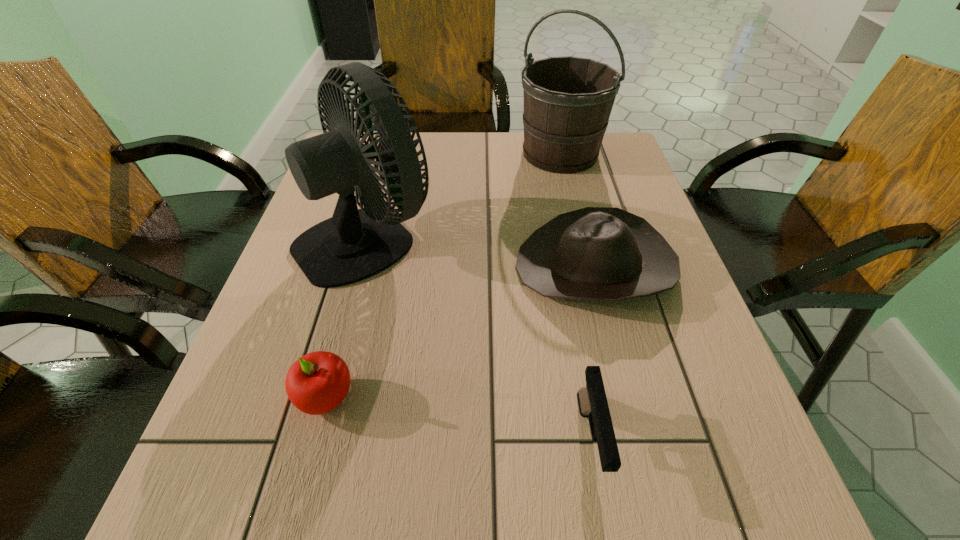
The height and width of the screenshot is (540, 960). In order to click on free space at the right edge of the desktop in this screenshot , I will do `click(648, 200)`.

Find the location of `free point at the near right corner`. free point at the near right corner is located at coordinates (659, 506).

Image resolution: width=960 pixels, height=540 pixels. Find the location of `unoccupied area between the apple and the farthest object`. unoccupied area between the apple and the farthest object is located at coordinates (443, 275).

Find the location of a particular element. This screenshot has height=540, width=960. vacant space that is in between the cowboy hat and the fan is located at coordinates (481, 252).

The width and height of the screenshot is (960, 540). In order to click on vacant point located between the apple and the pistol in this screenshot , I will do `click(458, 418)`.

Find the location of a particular element. vacant space that's between the cowboy hat and the fan is located at coordinates pos(481,252).

Identify the location of vacant area that lies between the pistol and the cowboy hat. (592, 353).

Identify the location of free space between the apple and the bucket. (443, 275).

The image size is (960, 540). Identify the location of free space between the pistol and the apple. (458, 418).

This screenshot has width=960, height=540. I want to click on free space between the fan and the farthest object, so click(x=464, y=195).